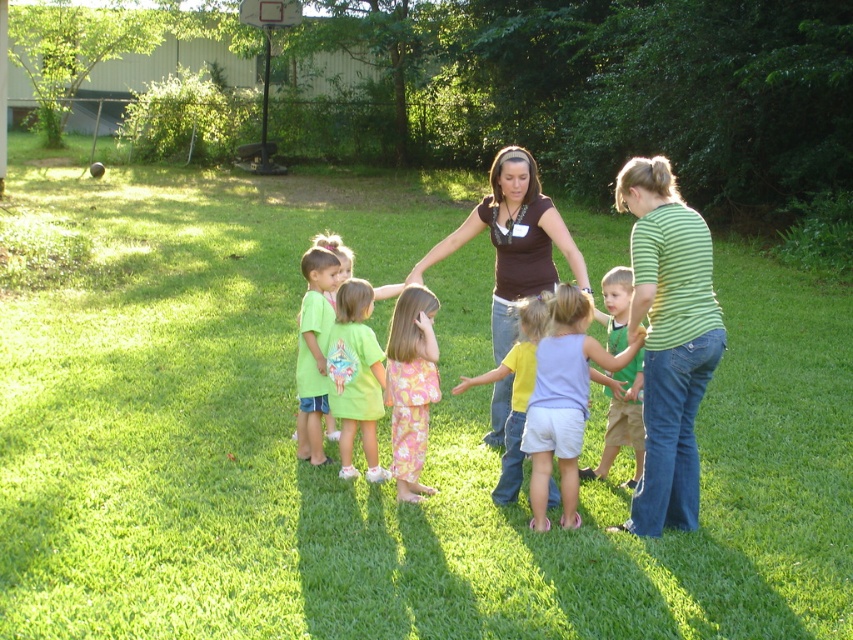
You are a photographer trying to capture a clear photo of both the green striped shirt at right and the brown fabric shirt at center. Since you can only focus on one subject at a time, which shirt should you focus on to ensure the other is still somewhat in focus?

You should focus on the green striped shirt at right because it is closer to the viewer than the brown fabric shirt at center, so focusing on the closer one will keep the farther one more in focus.